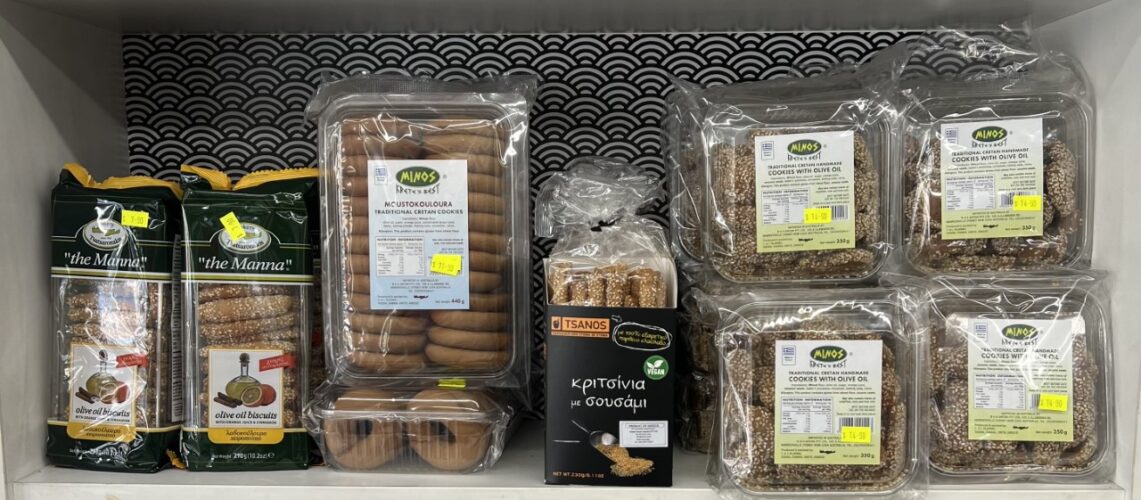
Where is `right set of cookie containers`? right set of cookie containers is located at coordinates (860, 181), (962, 191), (1013, 328), (820, 368).